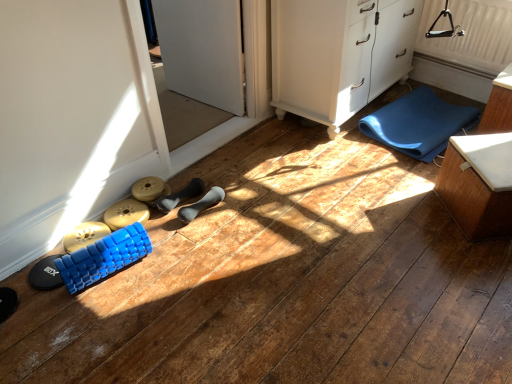
Question: Is blue textured foam roller at lower left, the third footwear in the right-to-left sequence, to the left of blue textured foam roller at lower left, positioned as the first toy in back-to-front order, from the viewer's perspective?

Choices:
 (A) yes
 (B) no

Answer: (A)

Question: Is blue textured foam roller at lower left, the third footwear in the right-to-left sequence, bigger than blue textured foam roller at lower left, positioned as the first toy in back-to-front order?

Choices:
 (A) no
 (B) yes

Answer: (A)

Question: Does blue textured foam roller at lower left, the third footwear in the right-to-left sequence, turn towards blue textured foam roller at lower left, which ranks as the second toy in front-to-back order?

Choices:
 (A) no
 (B) yes

Answer: (A)

Question: Can you confirm if blue textured foam roller at lower left, placed as the 2th footwear when sorted from left to right, is thinner than blue textured foam roller at lower left, positioned as the first toy in back-to-front order?

Choices:
 (A) no
 (B) yes

Answer: (B)

Question: Can you confirm if blue textured foam roller at lower left, the third footwear in the right-to-left sequence, is shorter than blue textured foam roller at lower left, positioned as the first toy in back-to-front order?

Choices:
 (A) yes
 (B) no

Answer: (A)

Question: In terms of size, does blue textured foam roller at lower left, placed as the 2th footwear when sorted from left to right, appear bigger or smaller than blue rubber yoga mat at lower right?

Choices:
 (A) big
 (B) small

Answer: (B)

Question: Is blue textured foam roller at lower left, placed as the 2th footwear when sorted from left to right, taller or shorter than blue rubber yoga mat at lower right?

Choices:
 (A) short
 (B) tall

Answer: (A)

Question: From the image's perspective, relative to blue rubber yoga mat at lower right, is blue textured foam roller at lower left, the third footwear in the right-to-left sequence, above or below?

Choices:
 (A) below
 (B) above

Answer: (A)

Question: Is point (56, 256) positioned closer to the camera than point (419, 140)?

Choices:
 (A) closer
 (B) farther

Answer: (A)

Question: Based on their sizes in the image, would you say blue textured foam roller at lower left, which ranks as the second toy in front-to-back order, is bigger or smaller than matte gray dumbbell at center, the 2th footwear viewed from the right?

Choices:
 (A) small
 (B) big

Answer: (A)

Question: From their relative heights in the image, would you say blue textured foam roller at lower left, which ranks as the second toy in front-to-back order, is taller or shorter than matte gray dumbbell at center, the 2th footwear viewed from the right?

Choices:
 (A) tall
 (B) short

Answer: (B)

Question: Does point (103, 215) appear closer or farther from the camera than point (177, 203)?

Choices:
 (A) closer
 (B) farther

Answer: (A)

Question: From the image's perspective, is blue textured foam roller at lower left, which ranks as the second toy in front-to-back order, above or below matte gray dumbbell at center, acting as the third footwear starting from the left?

Choices:
 (A) above
 (B) below

Answer: (B)

Question: In the image, is blue foam roller at lower left, the 2th toy when ordered from back to front, on the left side or the right side of black rubber shoe at center, placed as the 1th footwear when sorted from right to left?

Choices:
 (A) right
 (B) left

Answer: (B)

Question: From a real-world perspective, is blue foam roller at lower left, which ranks as the 1th toy in front-to-back order, positioned above or below black rubber shoe at center, acting as the 4th footwear starting from the left?

Choices:
 (A) above
 (B) below

Answer: (A)